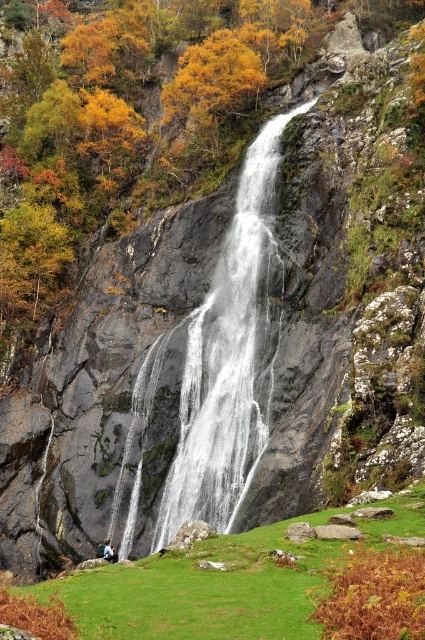
You are a hiker who wants to cross the waterfall area. You see the white frothy water at center and the blue denim jacket at lower center. Which object is bigger and could potentially block your path?

The white frothy water at center is larger in size compared to the blue denim jacket at lower center, so it could potentially block your path.